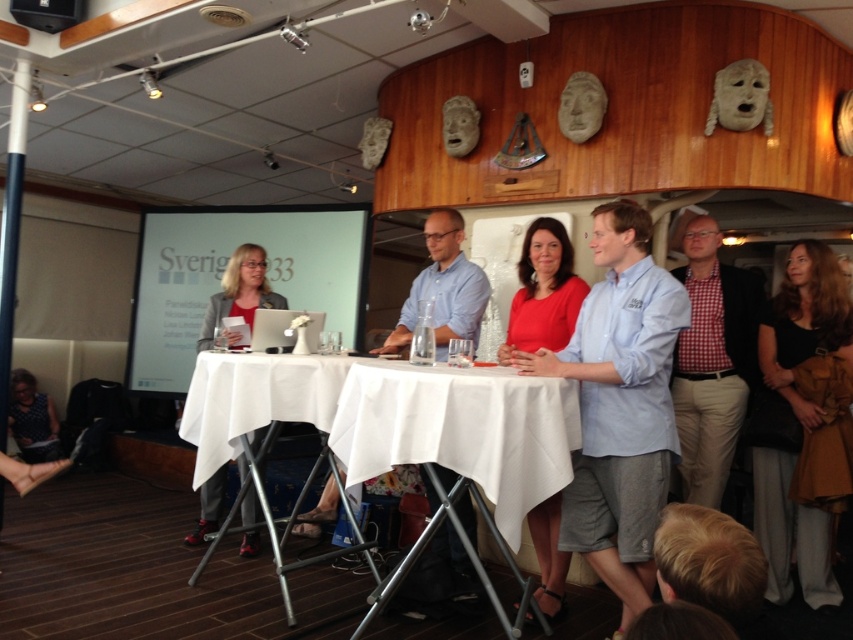
Question: Is matte red dress at center in front of matte gray blazer at center?

Choices:
 (A) no
 (B) yes

Answer: (B)

Question: Is matte gray blazer at center bigger than dark blue dotted dress at lower left?

Choices:
 (A) yes
 (B) no

Answer: (B)

Question: Which of the following is the farthest from the observer?

Choices:
 (A) (273, 292)
 (B) (648, 436)
 (C) (339, 401)

Answer: (A)

Question: Which point is farther to the camera?

Choices:
 (A) white cloth-covered table at center
 (B) matte red dress at center
 (C) white matte projection screen at center
 (D) dark blue dotted dress at lower left

Answer: (D)

Question: Among these objects, which one is nearest to the camera?

Choices:
 (A) red checkered shirt at right
 (B) white cloth-covered table at center
 (C) dark blue dotted dress at lower left
 (D) matte gray blazer at center

Answer: (B)

Question: Does red checkered shirt at right appear under white cloth-covered table at center?

Choices:
 (A) yes
 (B) no

Answer: (B)